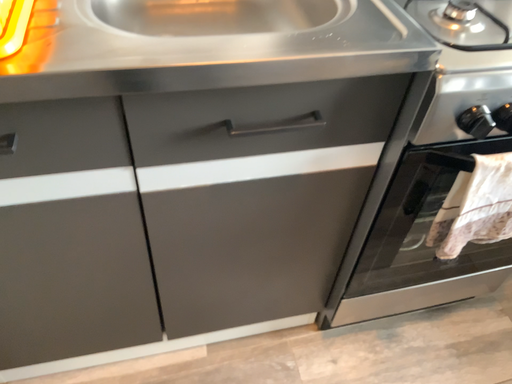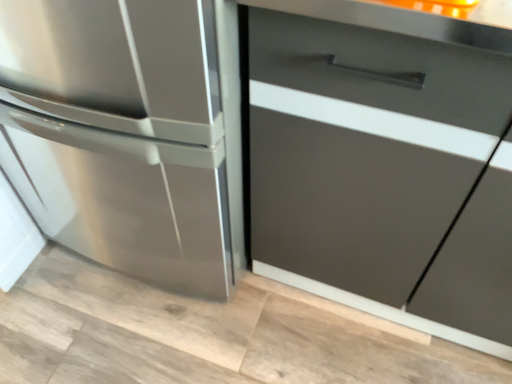
Question: How did the camera likely rotate when shooting the video?

Choices:
 (A) rotated left
 (B) rotated right

Answer: (A)